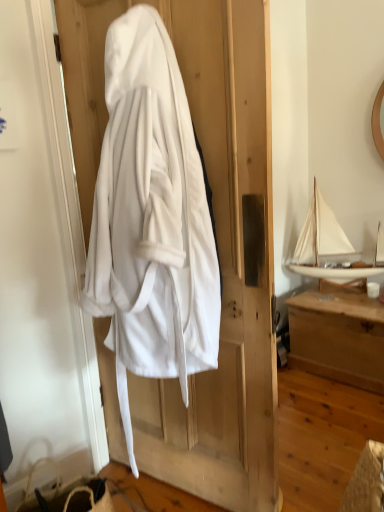
Question: Is white soft robe at center outside of white fabric screen door at left?

Choices:
 (A) yes
 (B) no

Answer: (A)

Question: Could white fabric screen door at left be considered to be inside white soft robe at center?

Choices:
 (A) yes
 (B) no

Answer: (B)

Question: Does white soft robe at center have a smaller size compared to white fabric screen door at left?

Choices:
 (A) no
 (B) yes

Answer: (A)

Question: Is white soft robe at center at the right side of white fabric screen door at left?

Choices:
 (A) no
 (B) yes

Answer: (B)

Question: Is white fabric screen door at left at the back of white soft robe at center?

Choices:
 (A) no
 (B) yes

Answer: (A)

Question: Considering the positions of white wooden boat at upper right and white soft robe at center in the image, is white wooden boat at upper right bigger or smaller than white soft robe at center?

Choices:
 (A) big
 (B) small

Answer: (B)

Question: Does point (304, 233) appear closer or farther from the camera than point (264, 302)?

Choices:
 (A) farther
 (B) closer

Answer: (A)

Question: From their relative heights in the image, would you say white wooden boat at upper right is taller or shorter than white soft robe at center?

Choices:
 (A) short
 (B) tall

Answer: (A)

Question: From a real-world perspective, is white wooden boat at upper right physically located above or below white soft robe at center?

Choices:
 (A) above
 (B) below

Answer: (B)

Question: Looking at their shapes, would you say wooden chest at right is wider or thinner than white soft robe at center?

Choices:
 (A) wide
 (B) thin

Answer: (A)

Question: Is wooden chest at right in front of or behind white soft robe at center in the image?

Choices:
 (A) front
 (B) behind

Answer: (B)

Question: Considering the positions of wooden chest at right and white soft robe at center in the image, is wooden chest at right taller or shorter than white soft robe at center?

Choices:
 (A) short
 (B) tall

Answer: (A)

Question: Is wooden chest at right inside the boundaries of white soft robe at center, or outside?

Choices:
 (A) outside
 (B) inside

Answer: (A)

Question: Is white soft robe at center inside or outside of white wooden boat at upper right?

Choices:
 (A) inside
 (B) outside

Answer: (B)

Question: From a real-world perspective, relative to white wooden boat at upper right, is white soft robe at center vertically above or below?

Choices:
 (A) below
 (B) above

Answer: (B)